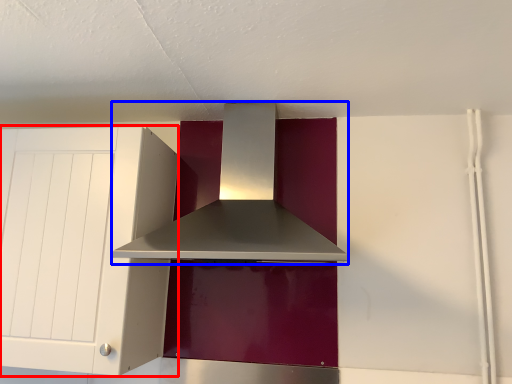
Question: Among these objects, which one is nearest to the camera, cabinetry (highlighted by a red box) or home appliance (highlighted by a blue box)?

Choices:
 (A) cabinetry
 (B) home appliance

Answer: (B)